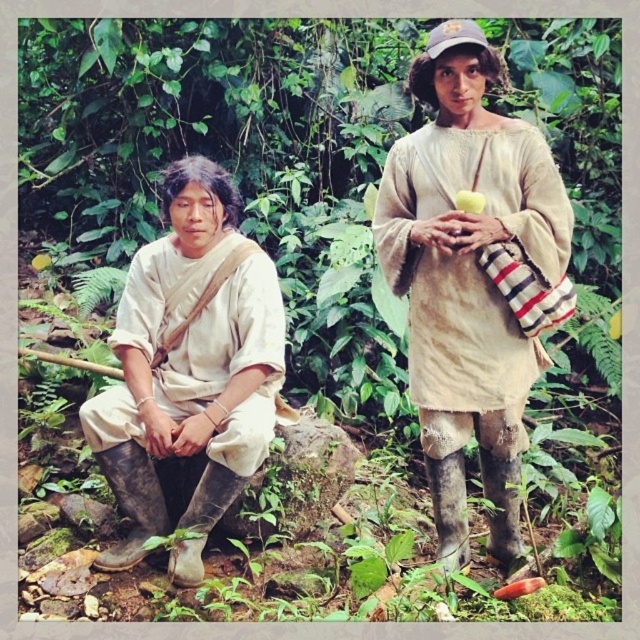
How far apart are matte beige robe at center and matte white shirt at left?

3.36 feet

Between matte beige robe at center and matte white shirt at left, which one appears on the right side from the viewer's perspective?

matte beige robe at center

Identify the location of matte beige robe at center. (468, 278).

Does matte beige robe at center lie in front of green matte apple at upper center?

Yes, matte beige robe at center is closer to the viewer.

Who is positioned more to the right, matte beige robe at center or green matte apple at upper center?

Positioned to the right is matte beige robe at center.

Is point (490, 170) closer to viewer compared to point (464, 192)?

No, it is not.

This screenshot has height=640, width=640. In order to click on matte beige robe at center in this screenshot , I will do `click(468, 278)`.

You are a GUI agent. You are given a task and a screenshot of the screen. Output one action in this format:
    pyautogui.click(x=<x>, y=<y>)
    Task: Click on the matte white shirt at left
    
    Given the screenshot: What is the action you would take?
    pyautogui.click(x=189, y=368)

How distant is matte white shirt at left from green matte apple at upper center?

matte white shirt at left is 4.78 feet from green matte apple at upper center.

This screenshot has height=640, width=640. Describe the element at coordinates (189, 368) in the screenshot. I see `matte white shirt at left` at that location.

The image size is (640, 640). I want to click on matte white shirt at left, so click(189, 368).